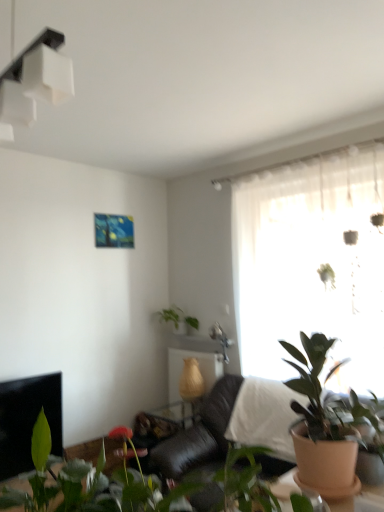
Question: Can you confirm if green matte plant at upper center, arranged as the 1th houseplant when viewed from the back, is positioned to the right of black leather couch at center?

Choices:
 (A) no
 (B) yes

Answer: (A)

Question: From the image's perspective, would you say green matte plant at upper center, which appears as the third houseplant when viewed from the front, is positioned over black leather couch at center?

Choices:
 (A) no
 (B) yes

Answer: (B)

Question: Is black leather couch at center inside green matte plant at upper center, arranged as the 1th houseplant when viewed from the back?

Choices:
 (A) no
 (B) yes

Answer: (A)

Question: Is green matte plant at upper center, which appears as the third houseplant when viewed from the front, taller than black leather couch at center?

Choices:
 (A) yes
 (B) no

Answer: (B)

Question: Considering the relative sizes of green matte plant at upper center, which appears as the third houseplant when viewed from the front, and black leather couch at center in the image provided, is green matte plant at upper center, which appears as the third houseplant when viewed from the front, wider than black leather couch at center?

Choices:
 (A) no
 (B) yes

Answer: (A)

Question: Is green matte plant at upper center, arranged as the 1th houseplant when viewed from the back, behind black leather couch at center?

Choices:
 (A) no
 (B) yes

Answer: (B)

Question: From a real-world perspective, is white matte light fixture at upper left on black leather couch at center?

Choices:
 (A) no
 (B) yes

Answer: (B)

Question: From a real-world perspective, is white matte light fixture at upper left beneath black leather couch at center?

Choices:
 (A) no
 (B) yes

Answer: (A)

Question: Is white matte light fixture at upper left closer to camera compared to black leather couch at center?

Choices:
 (A) yes
 (B) no

Answer: (A)

Question: Considering the relative sizes of white matte light fixture at upper left and black leather couch at center in the image provided, is white matte light fixture at upper left shorter than black leather couch at center?

Choices:
 (A) no
 (B) yes

Answer: (B)

Question: Is white matte light fixture at upper left positioned behind black leather couch at center?

Choices:
 (A) no
 (B) yes

Answer: (A)

Question: Is white matte light fixture at upper left not close to black leather couch at center?

Choices:
 (A) no
 (B) yes

Answer: (B)

Question: From a real-world perspective, does translucent glass window at center stand above white matte light fixture at upper left?

Choices:
 (A) yes
 (B) no

Answer: (B)